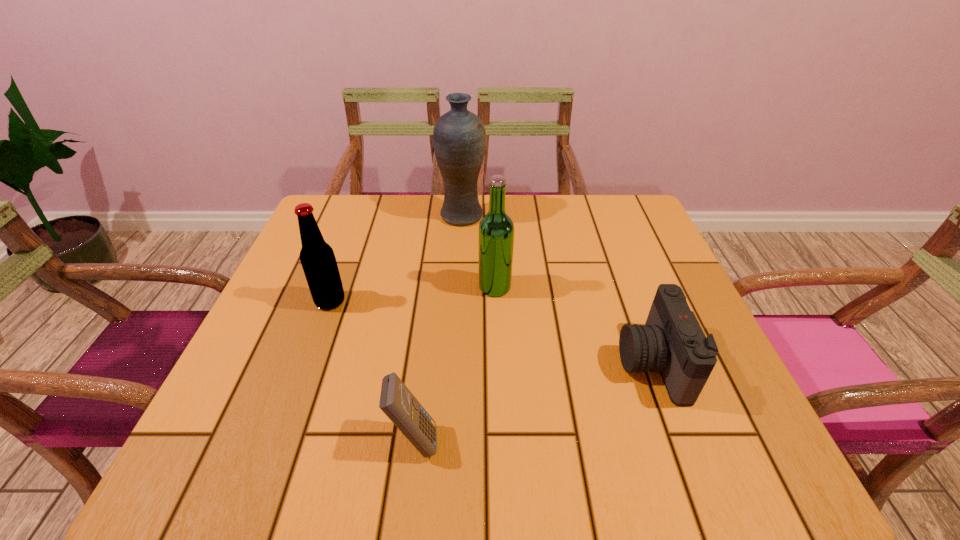
Find the location of `vacant area that lies between the farthest object and the left beer bottle`. vacant area that lies between the farthest object and the left beer bottle is located at coordinates (396, 259).

Where is `empty location between the farthest object and the nearest object`? This screenshot has height=540, width=960. empty location between the farthest object and the nearest object is located at coordinates (438, 327).

This screenshot has width=960, height=540. What are the coordinates of `empty space between the nearest object and the rightmost object` in the screenshot? It's located at click(533, 401).

In order to click on free space between the calculator and the farthest object in this screenshot , I will do `click(438, 327)`.

This screenshot has height=540, width=960. I want to click on object that is the fourth closest one to the right beer bottle, so click(x=398, y=403).

Identify which object is located as the fourth nearest to the tallest object. Please provide its 2D coordinates. Your answer should be formatted as a tuple, i.e. [(x, y)], where the tuple contains the x and y coordinates of a point satisfying the conditions above.

[(398, 403)]